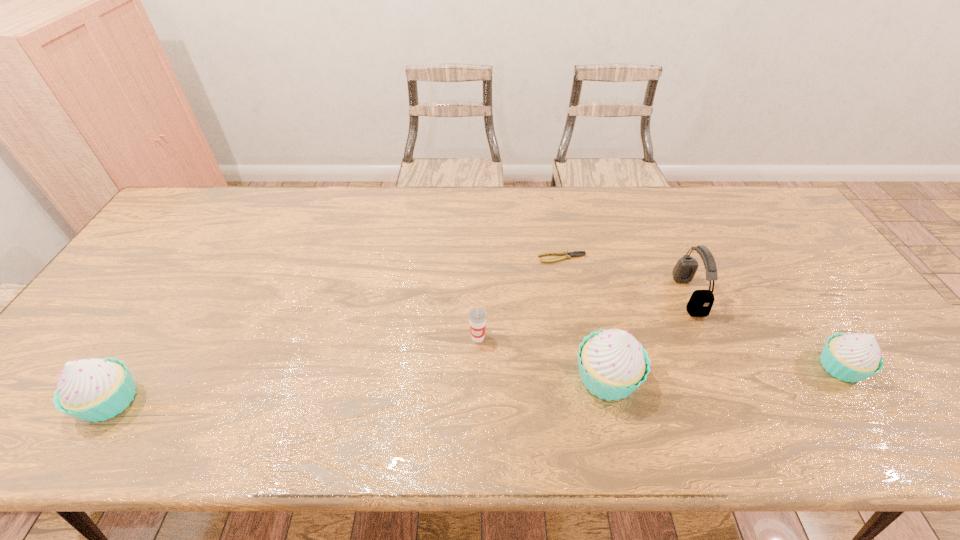
You are a GUI agent. You are given a task and a screenshot of the screen. Output one action in this format:
    pyautogui.click(x=<x>, y=<y>)
    Task: Click on the cup
    
    Given the screenshot: What is the action you would take?
    pyautogui.click(x=477, y=316)

This screenshot has height=540, width=960. What are the coordinates of `vacant space located 0.210m on the right of the second tallest cupcake` in the screenshot? It's located at (232, 401).

At what (x,y) coordinates should I click in order to perform the action: click on vacant area located on the left of the second cupcake from right to left. Please return your answer as a coordinate pair (x, y). The image size is (960, 540). Looking at the image, I should click on (501, 377).

The height and width of the screenshot is (540, 960). Identify the location of free location located on the back of the shortest cupcake. (806, 316).

You are a GUI agent. You are given a task and a screenshot of the screen. Output one action in this format:
    pyautogui.click(x=<x>, y=<y>)
    Task: Click on the blank space located on the back of the farthest object
    The height and width of the screenshot is (540, 960).
    Given the screenshot: What is the action you would take?
    [554, 214]

You are a GUI agent. You are given a task and a screenshot of the screen. Output one action in this format:
    pyautogui.click(x=<x>, y=<y>)
    Task: Click on the free space located 0.220m on the headband of the second object from right to left
    This screenshot has height=540, width=960.
    Given the screenshot: What is the action you would take?
    pyautogui.click(x=600, y=295)

Identify the location of vacant space located on the headband of the second object from right to left. (542, 295).

In order to click on vacant position located on the headband of the second object from right to left in this screenshot , I will do `click(592, 295)`.

Locate an element on the screen. This screenshot has width=960, height=540. free space located on the side of the second object from left to right with the logo is located at coordinates (478, 362).

In order to click on object positioned at the left edge in this screenshot , I will do `click(92, 389)`.